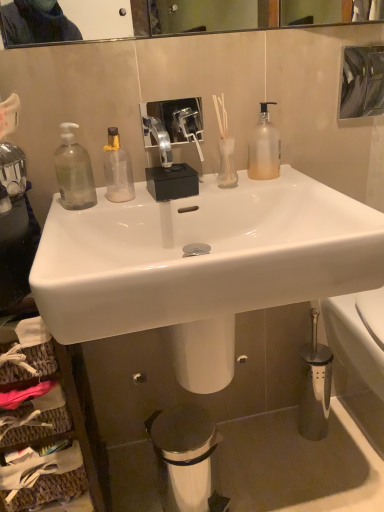
The height and width of the screenshot is (512, 384). Identify the location of free space to the left of metallic trash can at lower center. coord(132,480).